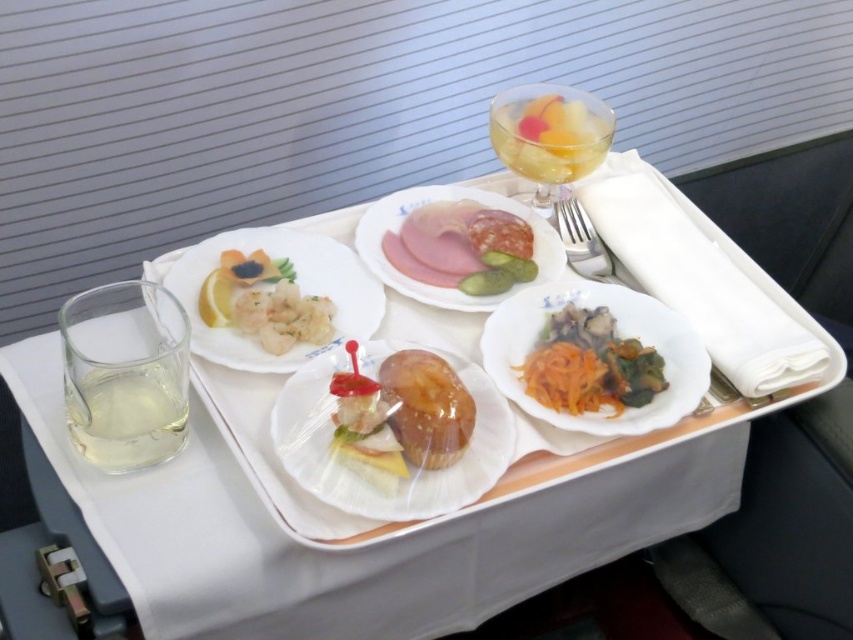
You are a flight attendant checking the meal tray. You need to place a small spoon on the tray. Which object should you place it on, the translucent plastic plate at center or the translucent glass cup at lower left, and why?

The translucent plastic plate at center is larger in size than the translucent glass cup at lower left, so the spoon should be placed on the translucent plastic plate at center because it has more space.

You are sitting in an airplane seat and looking at the meal tray. There are two points marked on the tray. Which point is closer to you, point (341, 332) or point (152, 394)?

Point (341, 332) is closer to you than point (152, 394) because it is further to the viewer.